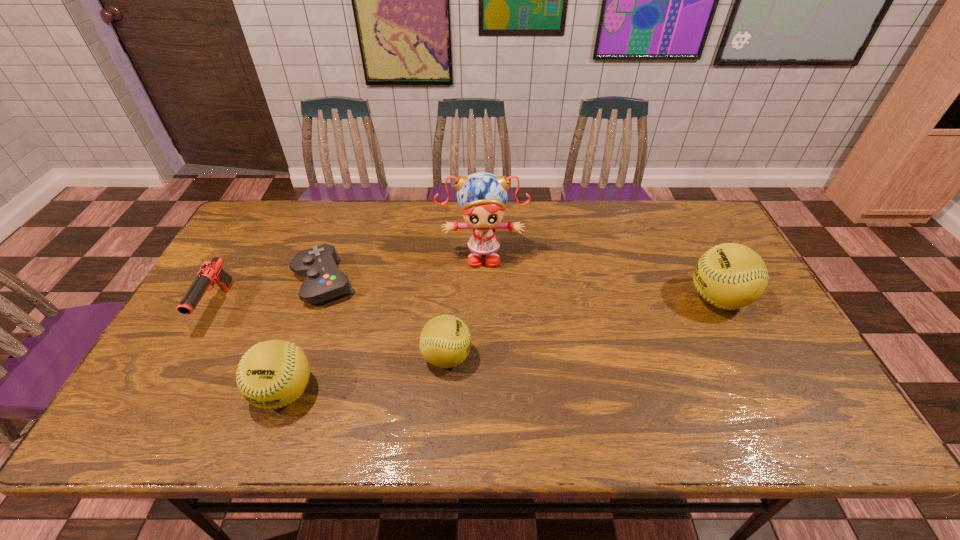
Where is `vacant space located 0.070m on the logo side of the rightmost softball`? vacant space located 0.070m on the logo side of the rightmost softball is located at coordinates (661, 298).

This screenshot has height=540, width=960. I want to click on free space located on the logo side of the rightmost softball, so click(x=605, y=298).

Locate an element on the screen. The image size is (960, 540). free space located 0.280m on the face of the doll is located at coordinates click(x=483, y=347).

The height and width of the screenshot is (540, 960). In order to click on vacant space located 0.120m at the aiming end of the leftmost object in this screenshot , I will do `click(180, 375)`.

Where is `free region located on the left of the control`? This screenshot has width=960, height=540. free region located on the left of the control is located at coordinates (263, 282).

Find the location of a particular element. The image size is (960, 540). object located in the far edge section of the desktop is located at coordinates (482, 197).

The image size is (960, 540). In order to click on object that is at the left edge in this screenshot , I will do `click(211, 272)`.

Find the location of a particular element. object located in the right edge section of the desktop is located at coordinates (730, 276).

The height and width of the screenshot is (540, 960). In order to click on vacant space at the far edge of the desktop in this screenshot , I will do `click(392, 200)`.

In order to click on free space at the near edge in this screenshot , I will do click(665, 397).